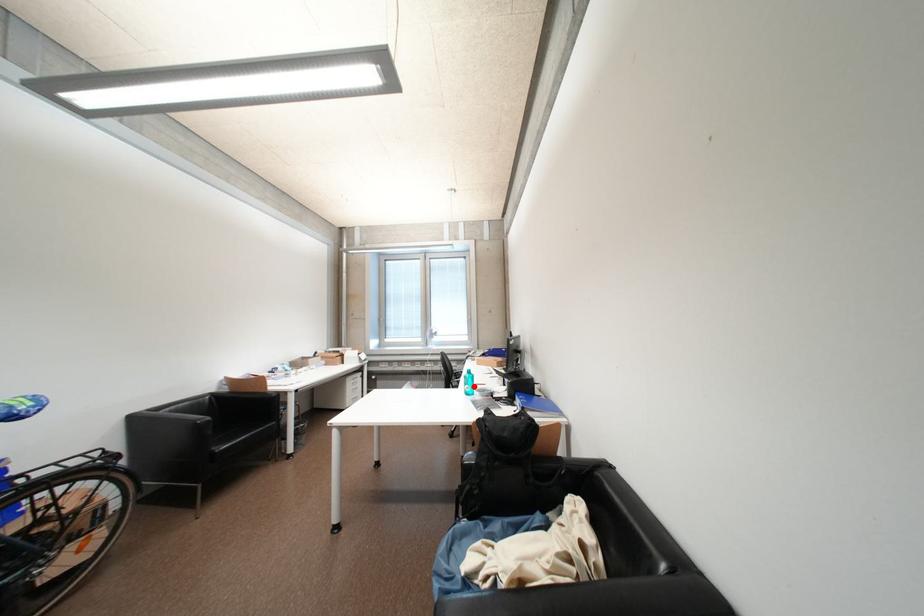
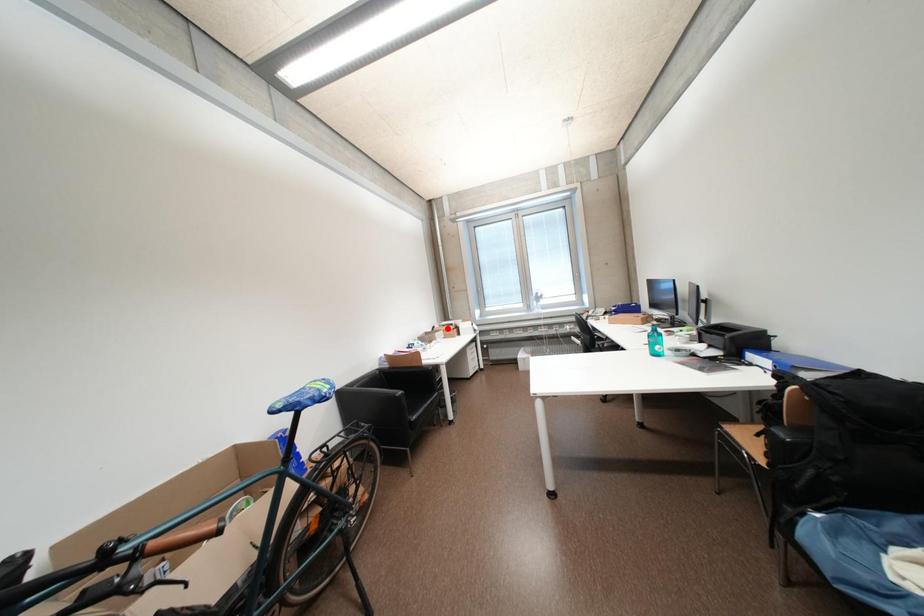
I am providing you with two images of the same scene from different viewpoints. A red point is marked on the first image and another point is marked on the second image. Does the point marked in image1 correspond to the same location as the one in image2?

No